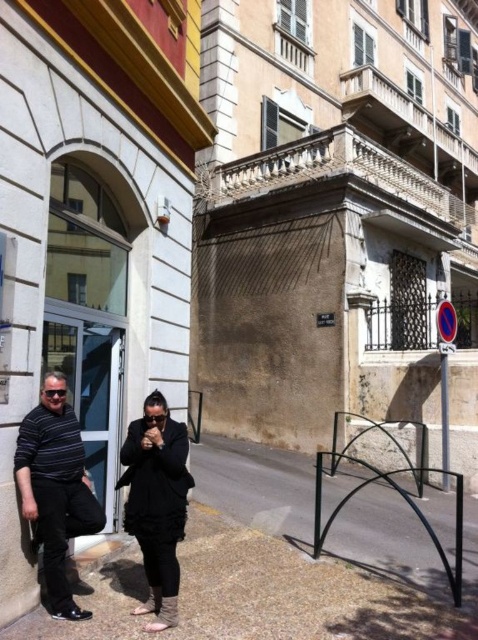
You are a delivery person who needs to place a package between the striped cotton shirt at left and the black matte coat at center. The package is 50 centimeters long. Can you fit the package between them without overlapping either?

The striped cotton shirt at left is 50.43 centimeters away from the black matte coat at center. Since the package is 50 centimeters long, it can fit between them as the distance is slightly more than the package length.